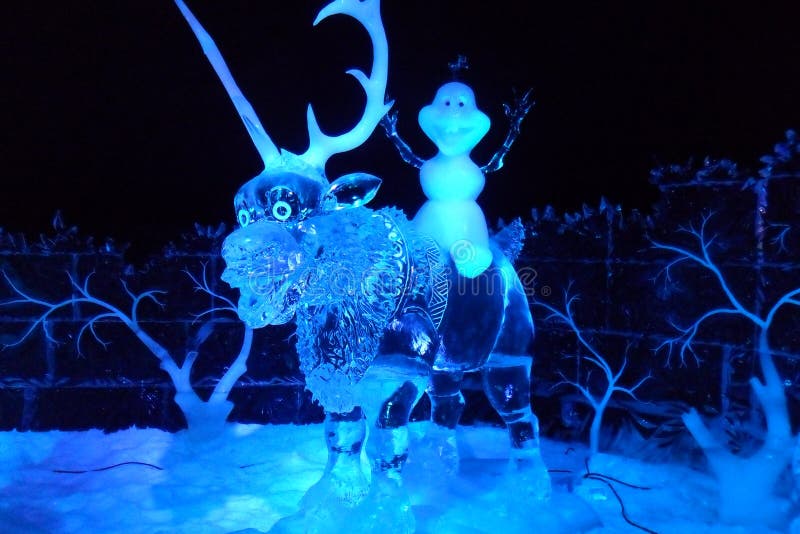
Where is `chest`? Image resolution: width=800 pixels, height=534 pixels. chest is located at coordinates (442, 179).